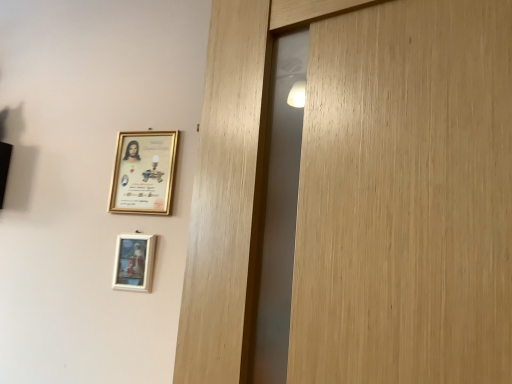
Question: Considering the relative positions of white matte picture frame at lower center, placed as the 1th picture frame when sorted from bottom to top, and gold-framed picture at upper left, which is the 1th picture frame from top to bottom, in the image provided, is white matte picture frame at lower center, placed as the 1th picture frame when sorted from bottom to top, to the left or to the right of gold-framed picture at upper left, which is the 1th picture frame from top to bottom,?

Choices:
 (A) left
 (B) right

Answer: (A)

Question: In the image, is white matte picture frame at lower center, placed as the 1th picture frame when sorted from bottom to top, positioned in front of or behind gold-framed picture at upper left, the second picture frame when ordered from bottom to top?

Choices:
 (A) front
 (B) behind

Answer: (A)

Question: From the image's perspective, relative to gold-framed picture at upper left, the second picture frame when ordered from bottom to top, is white matte picture frame at lower center, placed as the 1th picture frame when sorted from bottom to top, above or below?

Choices:
 (A) below
 (B) above

Answer: (A)

Question: Considering the positions of gold-framed picture at upper left, which is the 1th picture frame from top to bottom, and white matte picture frame at lower center, placed as the 1th picture frame when sorted from bottom to top, in the image, is gold-framed picture at upper left, which is the 1th picture frame from top to bottom, bigger or smaller than white matte picture frame at lower center, placed as the 1th picture frame when sorted from bottom to top,?

Choices:
 (A) small
 (B) big

Answer: (B)

Question: Considering the positions of point (153, 173) and point (152, 235), is point (153, 173) closer or farther from the camera than point (152, 235)?

Choices:
 (A) farther
 (B) closer

Answer: (A)

Question: Relative to white matte picture frame at lower center, placed as the 1th picture frame when sorted from bottom to top, is gold-framed picture at upper left, the second picture frame when ordered from bottom to top, in front or behind?

Choices:
 (A) behind
 (B) front

Answer: (A)

Question: Considering the positions of gold-framed picture at upper left, which is the 1th picture frame from top to bottom, and white matte picture frame at lower center, which appears as the second picture frame when viewed from the top, in the image, is gold-framed picture at upper left, which is the 1th picture frame from top to bottom, taller or shorter than white matte picture frame at lower center, which appears as the second picture frame when viewed from the top,?

Choices:
 (A) tall
 (B) short

Answer: (A)